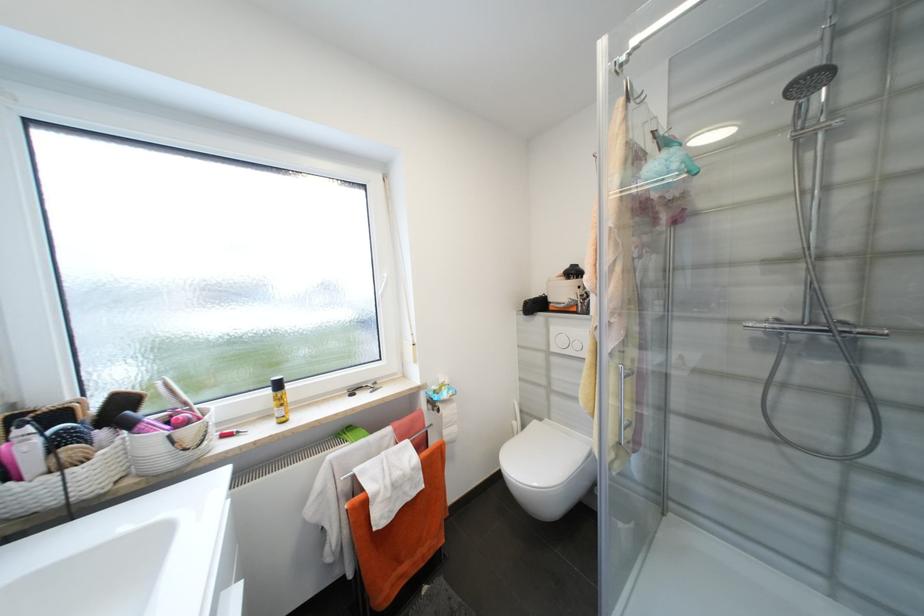
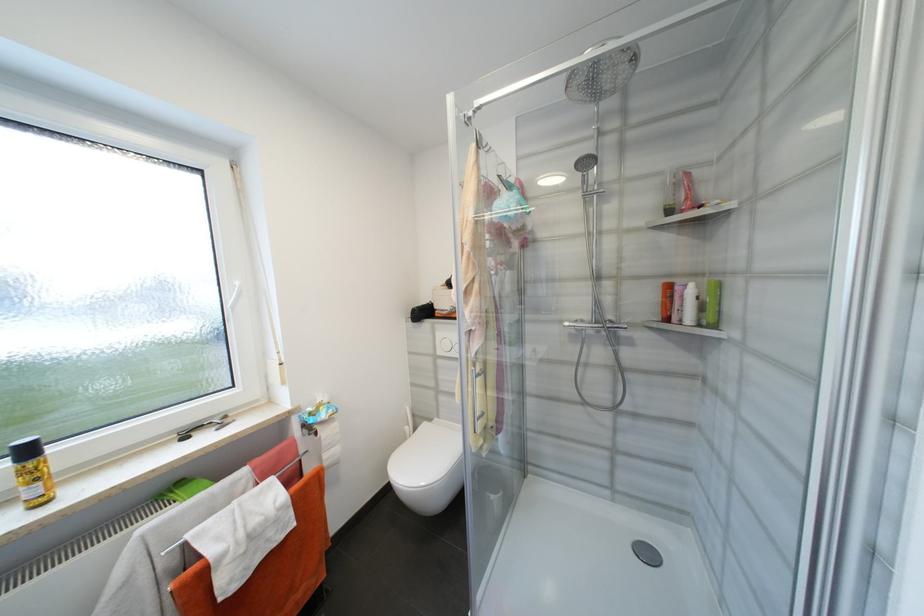
Where in the second image is the point corresponding to (x=560, y=350) from the first image?

(445, 353)